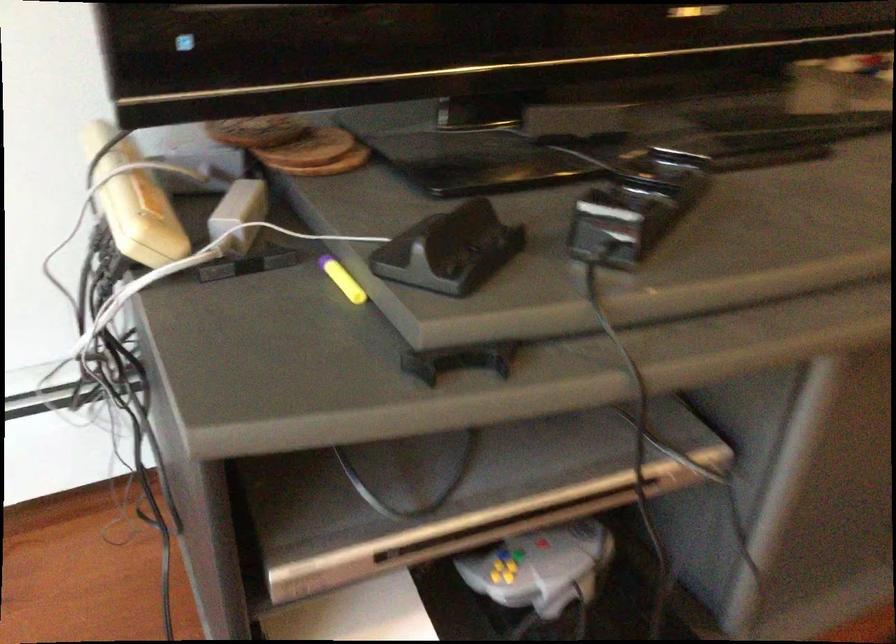
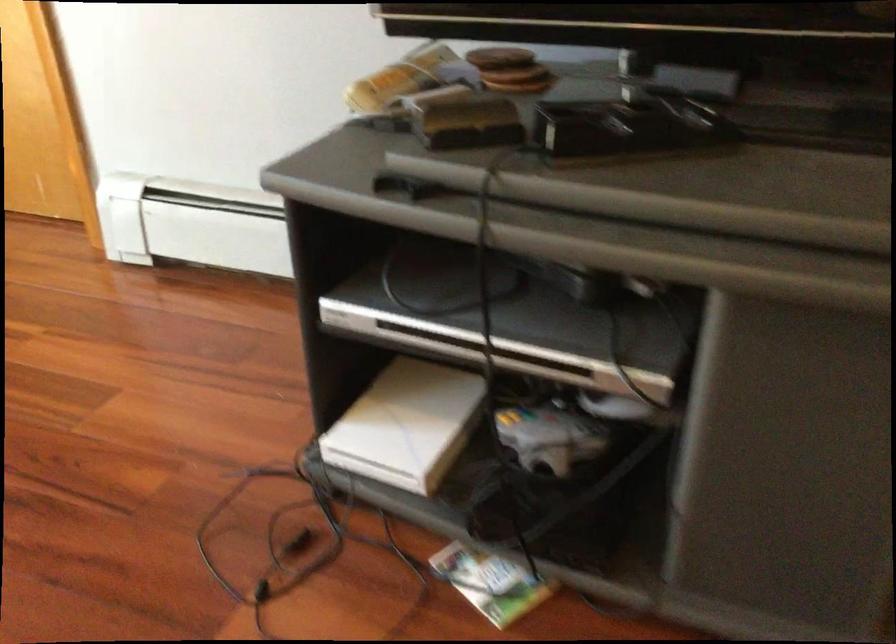
Where in the second image is the point corresponding to point (460, 241) from the first image?

(469, 124)